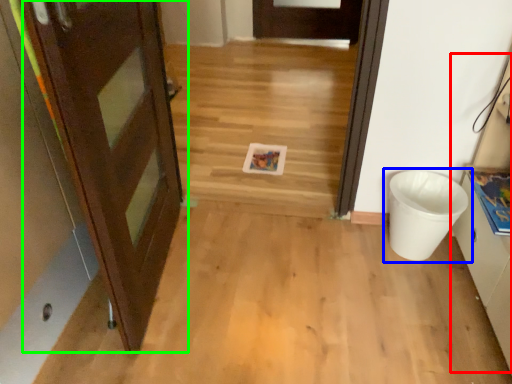
Question: Which object is positioned farthest from cabinetry (highlighted by a red box)? Select from waste container (highlighted by a blue box) and door (highlighted by a green box).

Choices:
 (A) waste container
 (B) door

Answer: (B)